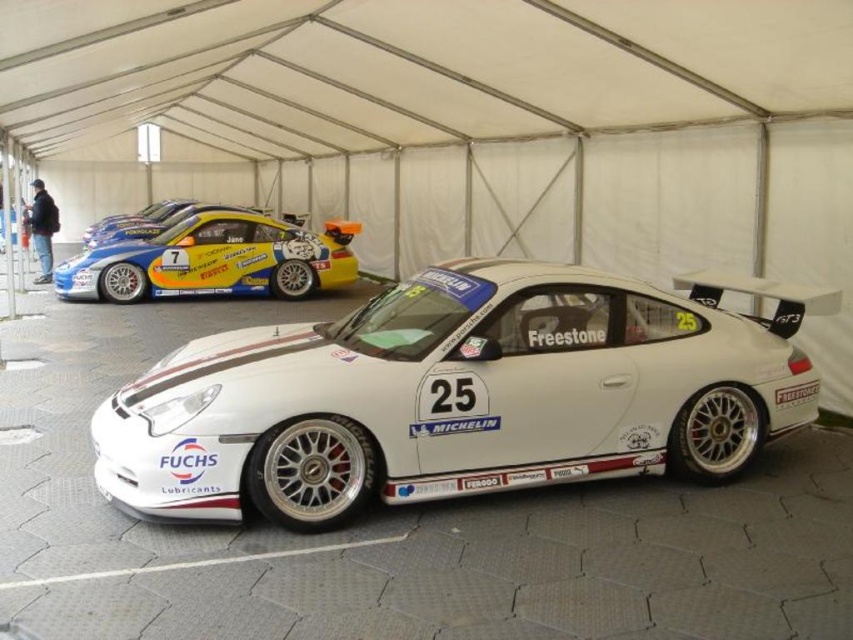
You are standing at the entrance of the tent and want to locate the point marked as (456,396). According to the scene description, where would this point be located?

The point marked as (456,396) is on the white matte race car at center.

Please use the coordinate system where the origin is at the bottom left corner of the image. The white matte race car at center is located at which coordinate point?

The white matte race car at center is located at coordinate point [456,396].